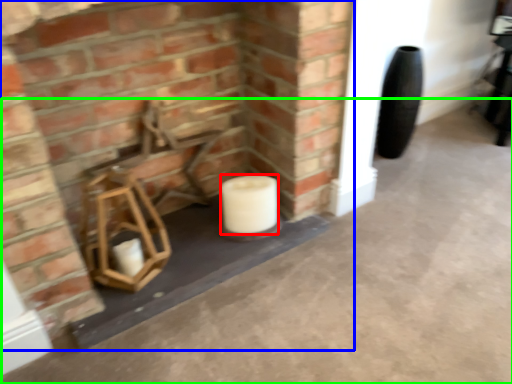
Question: Which object is positioned closest to toilet paper (highlighted by a red box)? Select from fireplace (highlighted by a blue box) and concrete (highlighted by a green box).

Choices:
 (A) fireplace
 (B) concrete

Answer: (A)